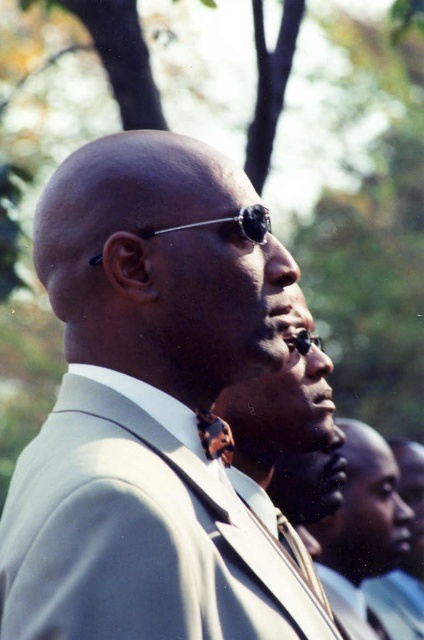
Question: Can you confirm if gray matte suit at center is positioned above dark brown leather tie at center?

Choices:
 (A) no
 (B) yes

Answer: (B)

Question: Does gray matte suit at center appear on the right side of dark brown leather tie at center?

Choices:
 (A) no
 (B) yes

Answer: (A)

Question: Among these points, which one is nearest to the camera?

Choices:
 (A) (53, 304)
 (B) (208, 449)
 (C) (343, 572)

Answer: (B)

Question: Which point is closer to the camera?

Choices:
 (A) (321, 534)
 (B) (214, 330)
 (C) (233, 442)

Answer: (B)

Question: Is gray matte suit at center wider than dark brown leather tie at center?

Choices:
 (A) yes
 (B) no

Answer: (A)

Question: Which of the following is the closest to the observer?

Choices:
 (A) (212, 417)
 (B) (348, 500)

Answer: (A)